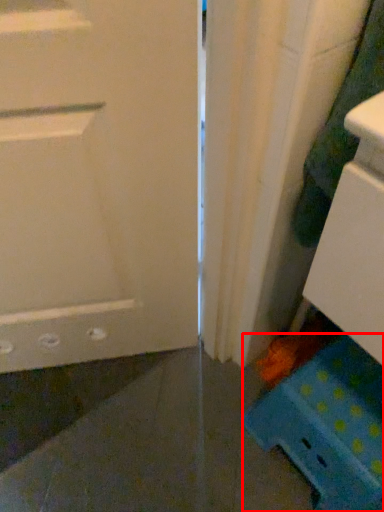
Question: Considering the relative positions of cabinetry (annotated by the red box) and laundry in the image provided, where is cabinetry (annotated by the red box) located with respect to the staircase?

Choices:
 (A) right
 (B) left

Answer: (A)